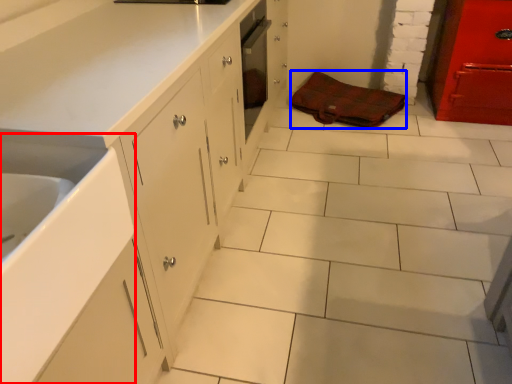
Question: Which object is further to the camera taking this photo, sink (highlighted by a red box) or material (highlighted by a blue box)?

Choices:
 (A) sink
 (B) material

Answer: (B)